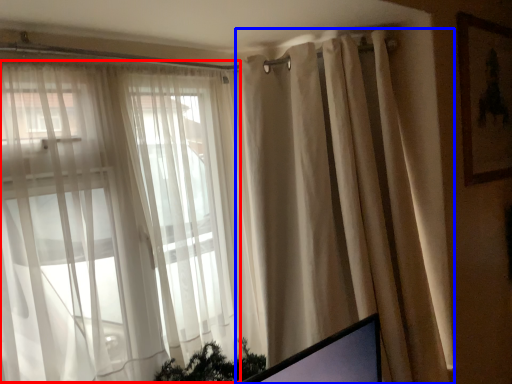
Question: Which object is further to the camera taking this photo, bay window (highlighted by a red box) or curtain (highlighted by a blue box)?

Choices:
 (A) bay window
 (B) curtain

Answer: (B)